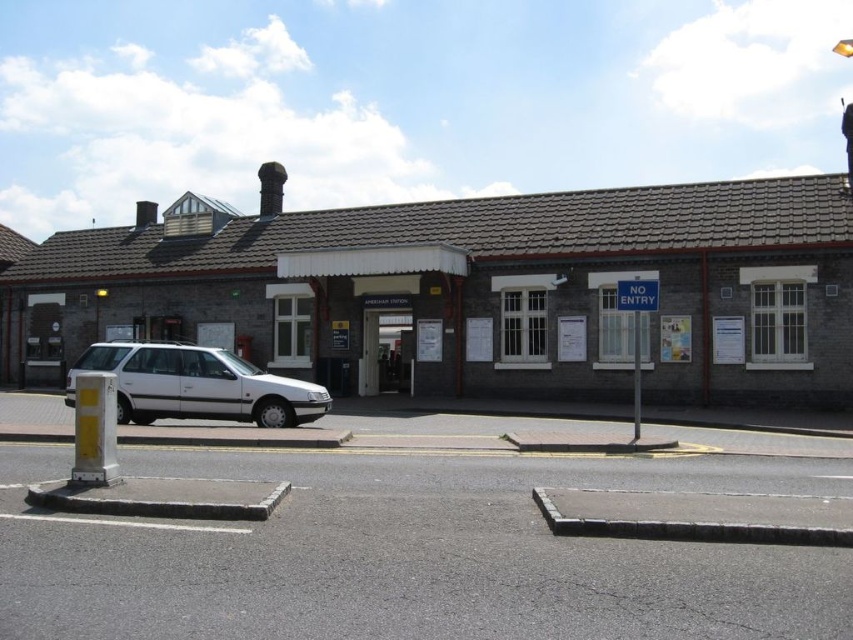
You are standing at the entrance of the train station and want to walk to the point that is closer to you. Which point should you head towards, point (201,403) or point (635,364)?

Point (201,403) is closer to the viewer than point (635,364), so you should head towards point (201,403).